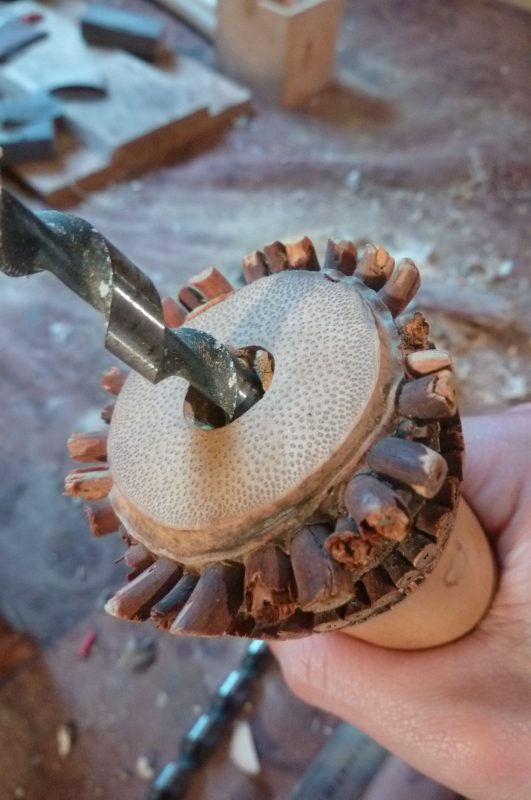
Identify the location of wood boards. Image resolution: width=531 pixels, height=800 pixels. (137, 118), (216, 85).